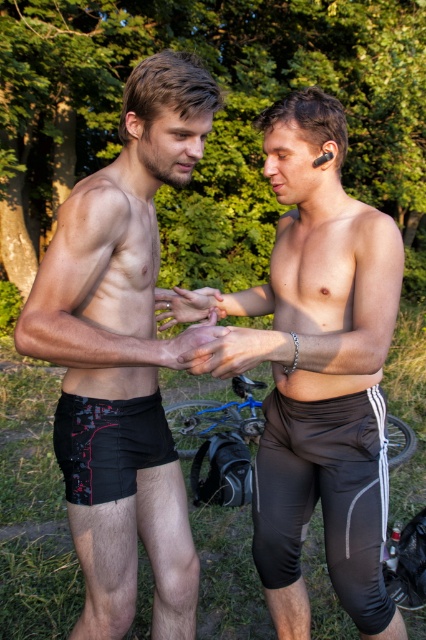
Question: Which object is the farthest from the matte black shorts at center?

Choices:
 (A) matte skin at center
 (B) black printed shorts at lower left

Answer: (B)

Question: Can you confirm if black matte shorts at left is positioned to the right of black printed shorts at lower left?

Choices:
 (A) yes
 (B) no

Answer: (B)

Question: Considering the real-world distances, which object is closest to the smooth skin hands at center?

Choices:
 (A) black matte shorts at left
 (B) smooth skin hand at center

Answer: (B)

Question: Based on their relative distances, which object is nearer to the blue metallic bicycle at center?

Choices:
 (A) smooth skin hand at center
 (B) black printed shorts at lower left
 (C) black matte shorts at left
 (D) matte skin at center

Answer: (D)

Question: Is matte black shorts at center below blue metallic bicycle at lower center?

Choices:
 (A) yes
 (B) no

Answer: (B)

Question: Does matte black shorts at center come behind blue metallic bicycle at center?

Choices:
 (A) yes
 (B) no

Answer: (B)